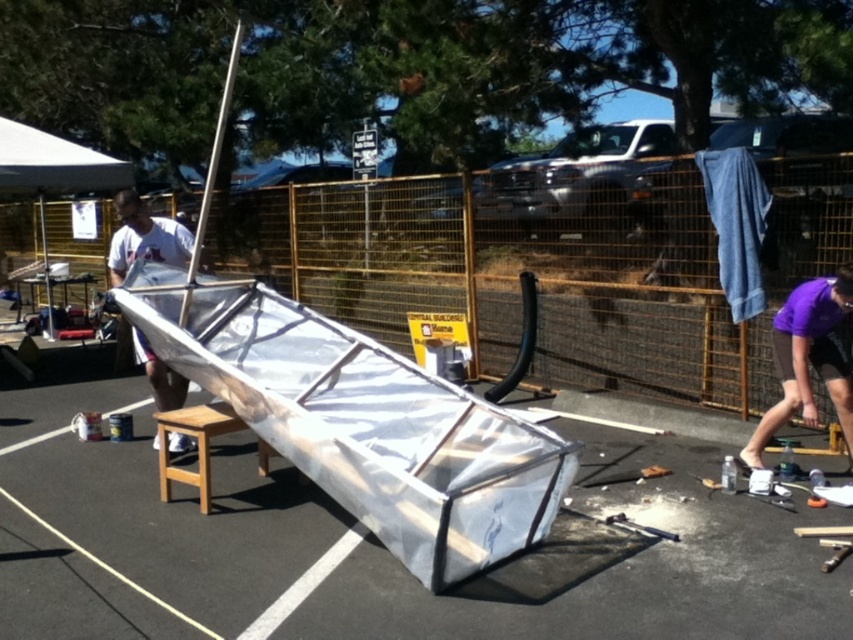
Question: Which of these objects is positioned closest to the transparent plastic ramp at center?

Choices:
 (A) light brown wooden stool at center
 (B) purple fabric at lower right

Answer: (A)

Question: Can you confirm if white fabric sailboat at left is positioned to the right of white fabric canopy at upper left?

Choices:
 (A) no
 (B) yes

Answer: (B)

Question: Can you confirm if white fabric canopy at upper left is positioned above light brown wooden stool at center?

Choices:
 (A) yes
 (B) no

Answer: (A)

Question: Which object is closer to the camera taking this photo?

Choices:
 (A) white fabric canopy at upper left
 (B) light brown wooden stool at center
 (C) white fabric sailboat at left
 (D) transparent plastic ramp at center

Answer: (D)

Question: Can you confirm if purple fabric at lower right is positioned below light brown wooden stool at center?

Choices:
 (A) yes
 (B) no

Answer: (B)

Question: Among these objects, which one is nearest to the camera?

Choices:
 (A) purple fabric at lower right
 (B) white fabric canopy at upper left
 (C) transparent plastic ramp at center
 (D) light brown wooden stool at center

Answer: (C)